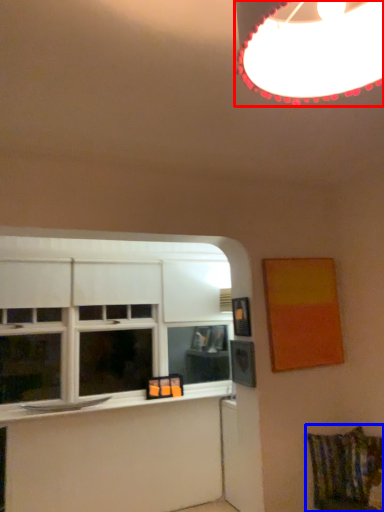
Question: Among these objects, which one is farthest to the camera, lamp (highlighted by a red box) or swivel chair (highlighted by a blue box)?

Choices:
 (A) lamp
 (B) swivel chair

Answer: (B)